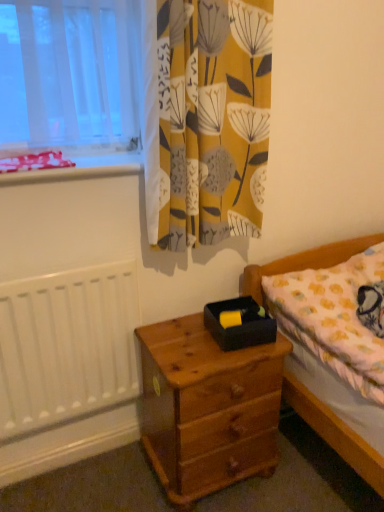
Where is `unoccupied area in front of black matte box at center`? This screenshot has height=512, width=384. unoccupied area in front of black matte box at center is located at coordinates (222, 356).